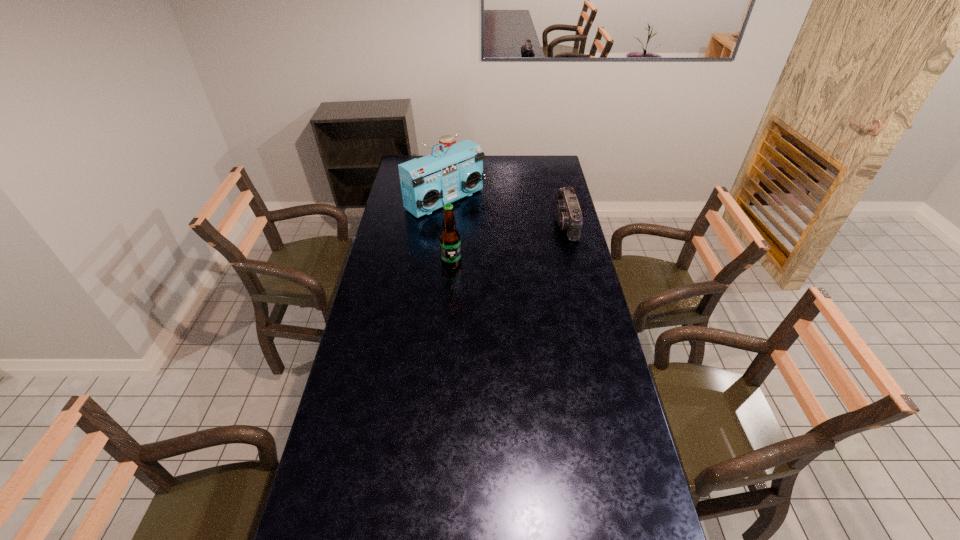
Locate an element on the screen. Image resolution: width=960 pixels, height=540 pixels. free space on the desktop that is between the nearest object and the rightmost object and is positioned on the front-facing side of the radio receiver is located at coordinates (507, 245).

You are a GUI agent. You are given a task and a screenshot of the screen. Output one action in this format:
    pyautogui.click(x=<x>, y=<y>)
    Task: Click on the free spot on the desktop that is between the third shortest object and the camcorder and is positioned on the front label of the farthest object
    The height and width of the screenshot is (540, 960).
    Given the screenshot: What is the action you would take?
    pyautogui.click(x=509, y=244)